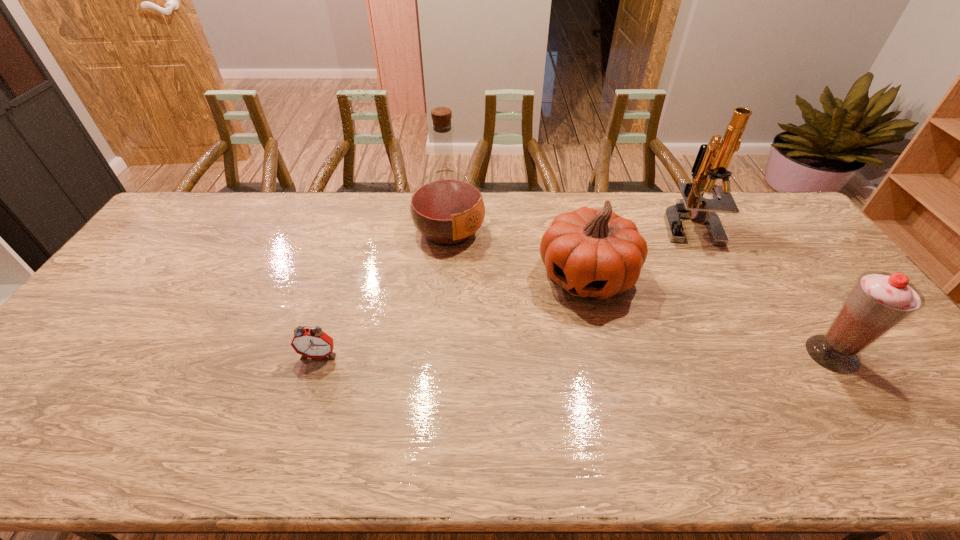
At what (x,y) coordinates should I click in order to perform the action: click on microscope located in the far edge section of the desktop. Please return your answer as a coordinate pair (x, y). Looking at the image, I should click on (712, 161).

Locate an element on the screen. The width and height of the screenshot is (960, 540). object that is at the right edge is located at coordinates (879, 302).

The height and width of the screenshot is (540, 960). In the image, there is a desktop. What are the coordinates of `free space at the far edge` in the screenshot? It's located at (326, 195).

Find the location of a particular element. This screenshot has width=960, height=540. vacant region at the near edge of the desktop is located at coordinates (639, 407).

Identify the location of free space at the left edge of the desktop. pyautogui.click(x=69, y=349).

This screenshot has height=540, width=960. I want to click on vacant space at the right edge of the desktop, so click(819, 255).

In order to click on free space at the far left corner of the desktop in this screenshot , I will do `click(221, 199)`.

Locate an element on the screen. This screenshot has height=540, width=960. blank region between the second object from left to right and the third tallest object is located at coordinates (640, 292).

Identify the location of free space between the shortest object and the liquor. (384, 293).

Find the location of a particular element. This screenshot has height=540, width=960. vacant area between the second object from left to right and the third shortest object is located at coordinates (640, 292).